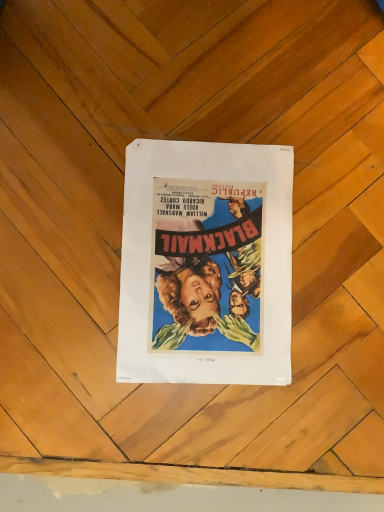
The image size is (384, 512). Describe the element at coordinates (206, 264) in the screenshot. I see `vibrant paper poster at center` at that location.

Where is `vibrant paper poster at center`? The image size is (384, 512). vibrant paper poster at center is located at coordinates (206, 264).

Find the location of `vibrant paper poster at center`. vibrant paper poster at center is located at coordinates point(206,264).